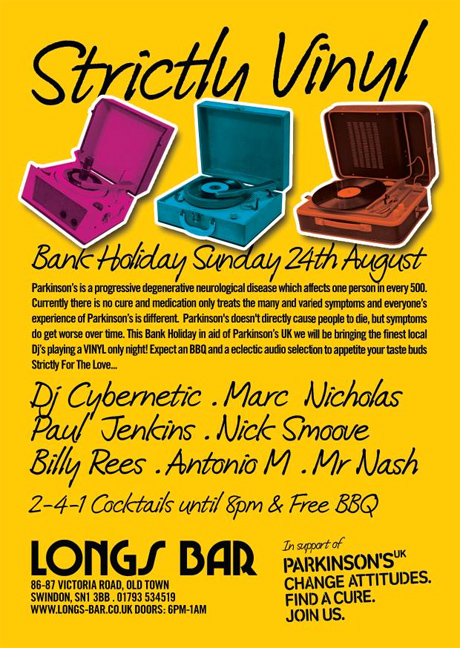
I want to click on white outlines around record players, so click(101, 235), click(258, 236), click(410, 234).